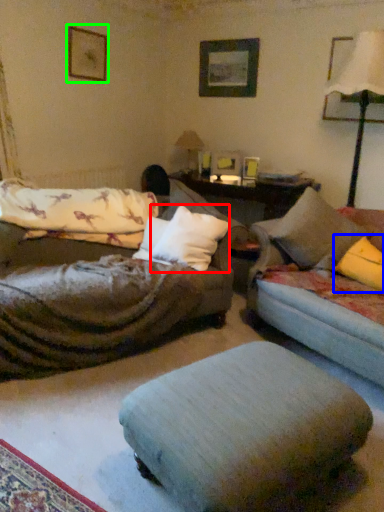
Question: Based on their relative distances, which object is farther from throw pillow (highlighted by a red box)? Choose from pillow (highlighted by a blue box) and picture frame (highlighted by a green box).

Choices:
 (A) pillow
 (B) picture frame

Answer: (B)